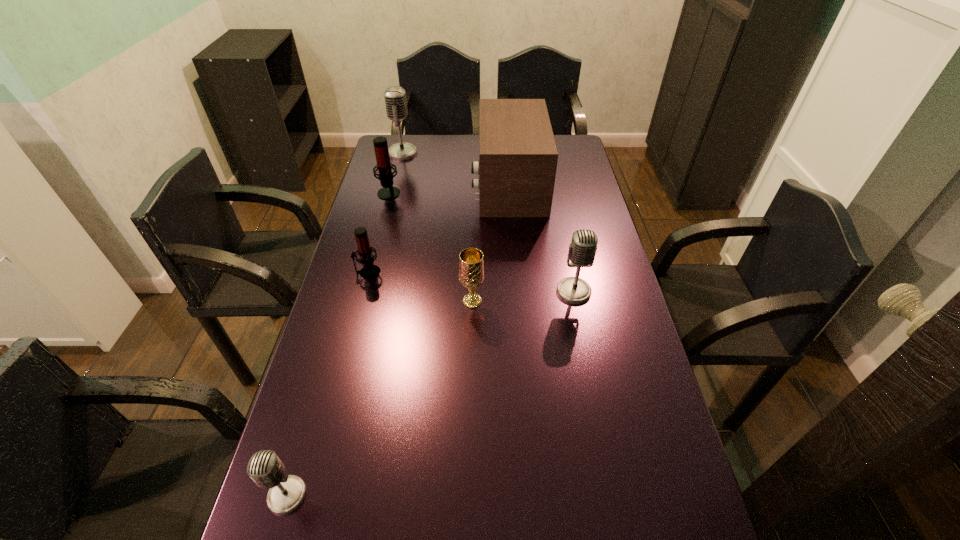
At what (x,y) coordinates should I click in order to perform the action: click on microphone that is at the far edge. Please return your answer as a coordinate pair (x, y). This screenshot has height=540, width=960. Looking at the image, I should click on (395, 98).

The image size is (960, 540). What are the coordinates of `radio receiver that is positioned at the far edge` in the screenshot? It's located at (518, 156).

Image resolution: width=960 pixels, height=540 pixels. I want to click on object that is positioned at the right edge, so click(582, 250).

Locate an element on the screen. This screenshot has width=960, height=540. object that is at the far left corner is located at coordinates (395, 98).

Locate an element on the screen. The width and height of the screenshot is (960, 540). vacant space at the left edge of the desktop is located at coordinates (386, 232).

In the image, there is a desktop. Where is `vacant space at the right edge`? vacant space at the right edge is located at coordinates (558, 170).

I want to click on free spot between the farther red microphone and the smaller red microphone, so click(x=378, y=232).

The image size is (960, 540). I want to click on free spot between the nearer red microphone and the smallest gray microphone, so click(327, 384).

At what (x,y) coordinates should I click in order to perform the action: click on unoccupied area between the bigger red microphone and the radio receiver. Please return your answer as a coordinate pair (x, y). The image size is (960, 540). Looking at the image, I should click on (448, 188).

You are a GUI agent. You are given a task and a screenshot of the screen. Output one action in this format:
    pyautogui.click(x=<x>, y=<y>)
    Task: Click on the unoccupied position between the smaller red microphone and the chalice
    
    Given the screenshot: What is the action you would take?
    pyautogui.click(x=420, y=287)